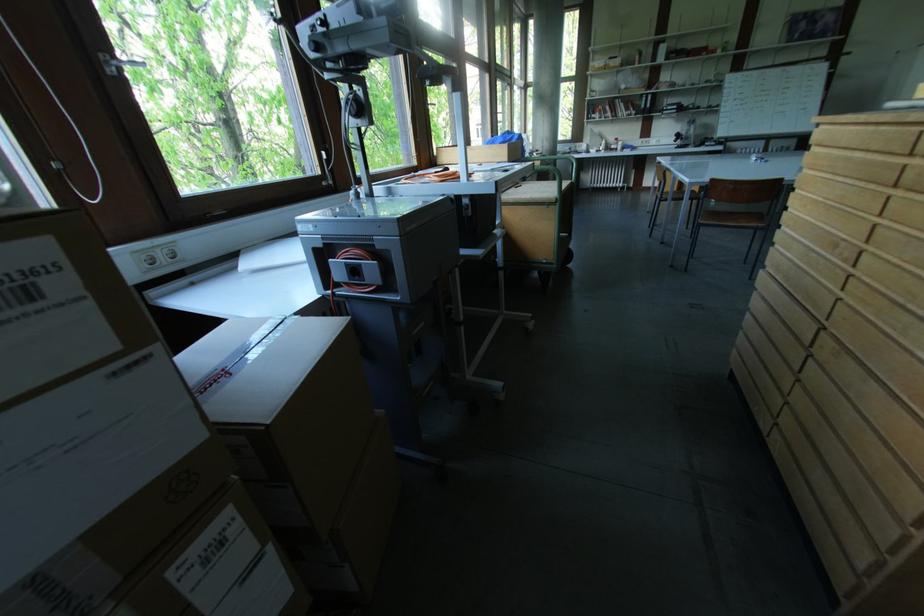
Locate an element on the screen. chair sitting surface is located at coordinates (734, 217).